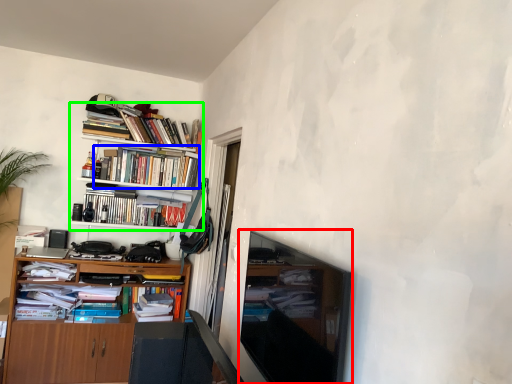
Question: Considering the real-world distances, which object is farthest from television (highlighted by a red box)? book (highlighted by a blue box) or bookcase (highlighted by a green box)?

Choices:
 (A) book
 (B) bookcase

Answer: (A)